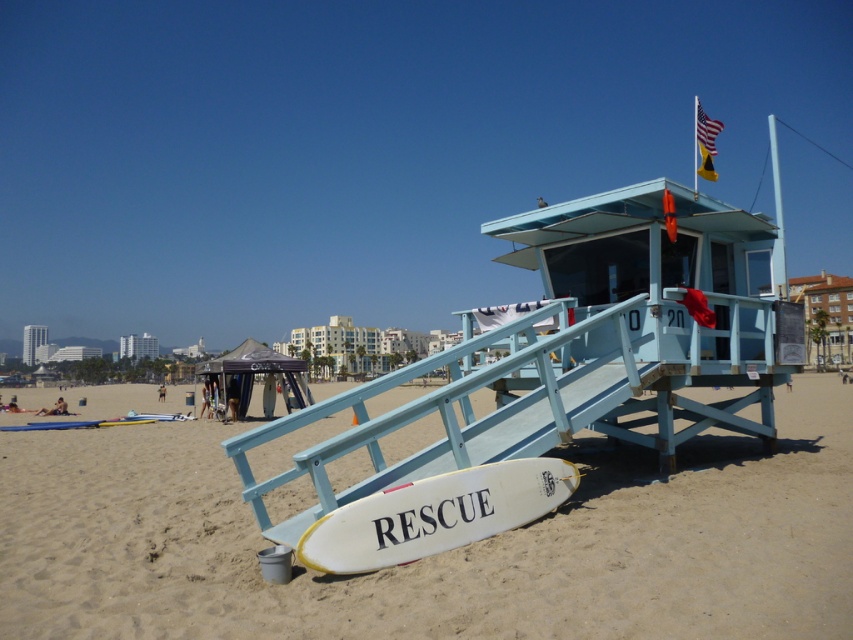
Question: Which point is closer to the camera?

Choices:
 (A) white matte surfboard at lower center
 (B) purple fabric canopy at lower left
 (C) white sand at lower center

Answer: (C)

Question: Does white matte surfboard at lower center appear over purple fabric canopy at lower left?

Choices:
 (A) no
 (B) yes

Answer: (B)

Question: Is white sand at lower center behind white matte surfboard at lower center?

Choices:
 (A) yes
 (B) no

Answer: (B)

Question: Does white sand at lower center appear under purple fabric canopy at lower left?

Choices:
 (A) yes
 (B) no

Answer: (A)

Question: Among these points, which one is farthest from the camera?

Choices:
 (A) (233, 396)
 (B) (229, 480)

Answer: (A)

Question: Among these objects, which one is nearest to the camera?

Choices:
 (A) purple fabric canopy at lower left
 (B) white sand at lower center
 (C) white matte surfboard at lower center

Answer: (B)